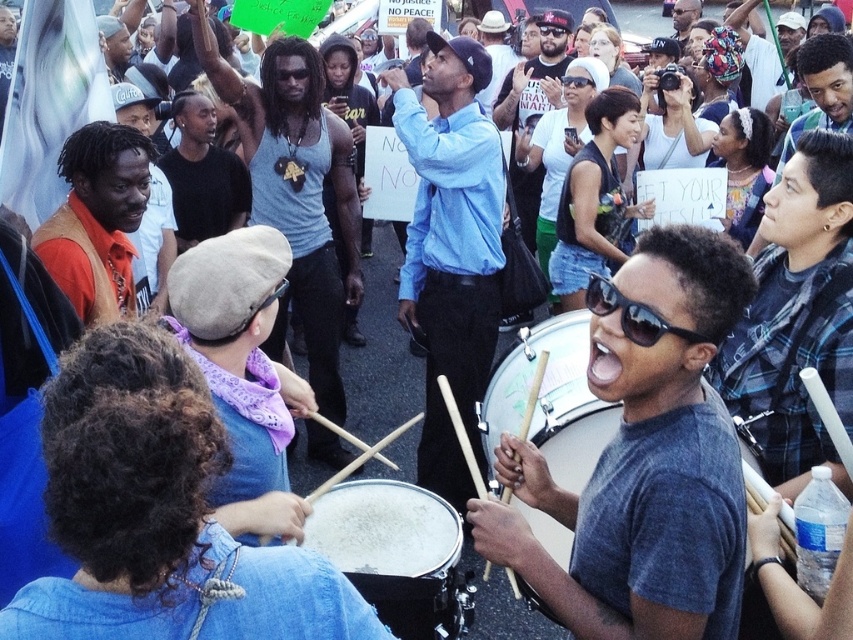
Question: Does gray matte drum at center appear over smooth black drum at center?

Choices:
 (A) yes
 (B) no

Answer: (A)

Question: Is light blue shirt at center to the left of matte blue tank top at center from the viewer's perspective?

Choices:
 (A) no
 (B) yes

Answer: (A)

Question: Based on their relative distances, which object is farther from the blue plaid shirt at right?

Choices:
 (A) gray matte drum at center
 (B) orange suede vest at left
 (C) matte blue tank top at center
 (D) light blue shirt at center

Answer: (C)

Question: Among these points, which one is nearest to the camera?

Choices:
 (A) (439, 544)
 (B) (729, 435)
 (C) (112, 225)
 (D) (837, 184)

Answer: (B)

Question: Which point is farther from the camera taking this photo?

Choices:
 (A) (502, 435)
 (B) (535, 417)

Answer: (B)

Question: Observing the image, what is the correct spatial positioning of gray matte drum at center in reference to blue plaid shirt at right?

Choices:
 (A) below
 (B) above

Answer: (A)